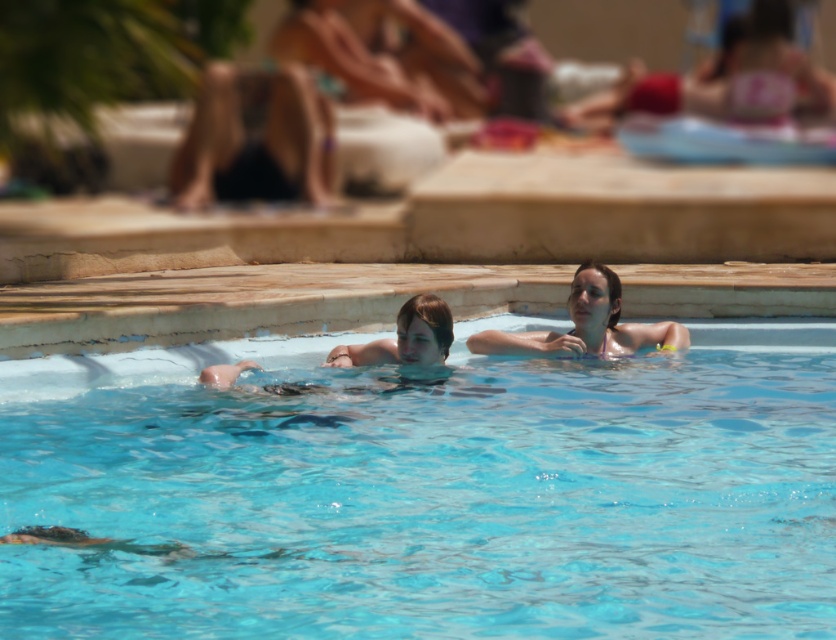
You are a photographer trying to capture a shot of the transparent blue water at center and the smooth skin woman at center. Based on their heights, which one should you focus on first if you want to ensure both are in the frame without needing to adjust your camera angle?

The transparent blue water at center is not as tall as the smooth skin woman at center, so you should focus on the smooth skin woman at center first to ensure both are in the frame without adjusting the camera angle.

You are a photographer standing at the edge of the pool. You want to take a photo that includes both the transparent blue water at center and the smooth skin woman at center. Which object should you position to the left side in your camera frame?

The smooth skin woman at center should be positioned to the left side in your camera frame because the transparent blue water at center is on its right side.